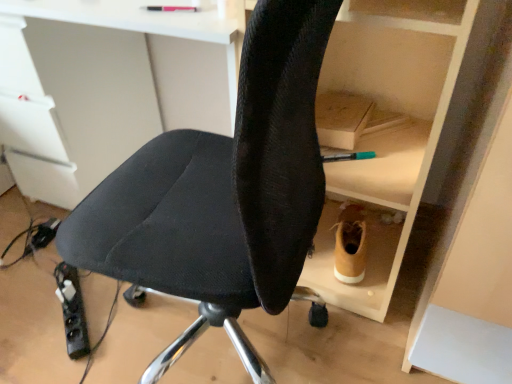
Locate an element on the screen. This screenshot has height=384, width=512. black fabric chair at center is located at coordinates (222, 192).

This screenshot has width=512, height=384. Describe the element at coordinates (350, 245) in the screenshot. I see `tan suede boot at lower right` at that location.

Find the location of a particular element. Image resolution: width=512 pixels, height=384 pixels. tan suede boot at lower right is located at coordinates (350, 245).

Find the location of a particular element. The height and width of the screenshot is (384, 512). black plastic power strip at lower left is located at coordinates (72, 310).

Is tan suede boot at lower right to the left or to the right of black plastic power strip at lower left in the image?

In the image, tan suede boot at lower right appears on the right side of black plastic power strip at lower left.

Who is shorter, tan suede boot at lower right or black plastic power strip at lower left?

Standing shorter between the two is black plastic power strip at lower left.

Can you tell me how much tan suede boot at lower right and black plastic power strip at lower left differ in facing direction?

They differ by 34.4 degrees in their facing directions.

Is black plastic power strip at lower left oriented away from black fabric chair at center?

black plastic power strip at lower left is not turned away from black fabric chair at center.

Looking at the image, does black plastic power strip at lower left seem bigger or smaller compared to black fabric chair at center?

Considering their sizes, black plastic power strip at lower left takes up less space than black fabric chair at center.

Is the surface of black plastic power strip at lower left in direct contact with black fabric chair at center?

No, black plastic power strip at lower left is not with black fabric chair at center.

Is point (82, 327) closer or farther from the camera than point (202, 158)?

Point (82, 327).

Which is more to the right, black plastic power strip at lower left or tan suede boot at lower right?

From the viewer's perspective, tan suede boot at lower right appears more on the right side.

In the scene shown: Is there a large distance between black plastic power strip at lower left and tan suede boot at lower right?

black plastic power strip at lower left is near tan suede boot at lower right, not far away.

From a real-world perspective, which is physically above, black plastic power strip at lower left or tan suede boot at lower right?

From a 3D spatial view, tan suede boot at lower right is above.

Is black plastic power strip at lower left thinner than tan suede boot at lower right?

In fact, black plastic power strip at lower left might be wider than tan suede boot at lower right.

Which of these two, tan suede boot at lower right or black fabric chair at center, is smaller?

With smaller size is tan suede boot at lower right.

Which of these two, tan suede boot at lower right or black fabric chair at center, is wider?

With larger width is black fabric chair at center.

From the image's perspective, relative to black fabric chair at center, is tan suede boot at lower right above or below?

From the image's perspective, tan suede boot at lower right appears below black fabric chair at center.

Is black fabric chair at center next to black plastic power strip at lower left and touching it?

No, black fabric chair at center is not touching black plastic power strip at lower left.

Does black fabric chair at center turn towards black plastic power strip at lower left?

Yes, black fabric chair at center is facing black plastic power strip at lower left.

In order to click on equipment below the black fabric chair at center (from the image's perspective) in this screenshot , I will do `click(72, 310)`.

Consider the image. Measure the distance between black fabric chair at center and black plastic power strip at lower left.

A distance of 63.90 centimeters exists between black fabric chair at center and black plastic power strip at lower left.

Which is more to the right, black fabric chair at center or tan suede boot at lower right?

tan suede boot at lower right is more to the right.

Would you consider black fabric chair at center to be distant from tan suede boot at lower right?

Actually, black fabric chair at center and tan suede boot at lower right are a little close together.

Is black fabric chair at center oriented towards tan suede boot at lower right?

No, black fabric chair at center is not facing towards tan suede boot at lower right.

Which object is more forward, black fabric chair at center or tan suede boot at lower right?

Positioned in front is black fabric chair at center.

You are a GUI agent. You are given a task and a screenshot of the screen. Output one action in this format:
    pyautogui.click(x=<x>, y=<y>)
    Task: Click on the equipment that is in front of the tan suede boot at lower right
    
    Given the screenshot: What is the action you would take?
    pyautogui.click(x=72, y=310)

Where is `chair on the right side of black plastic power strip at lower left`? Image resolution: width=512 pixels, height=384 pixels. chair on the right side of black plastic power strip at lower left is located at coordinates (222, 192).

From the image, which object appears to be nearer to tan suede boot at lower right, black fabric chair at center or black plastic power strip at lower left?

The object closer to tan suede boot at lower right is black fabric chair at center.

Which object lies nearer to the anchor point black fabric chair at center, tan suede boot at lower right or black plastic power strip at lower left?

tan suede boot at lower right.

In the scene shown: From the image, which object appears to be farther from tan suede boot at lower right, black plastic power strip at lower left or black fabric chair at center?

black plastic power strip at lower left is further to tan suede boot at lower right.

Which object lies nearer to the anchor point black plastic power strip at lower left, black fabric chair at center or tan suede boot at lower right?

black fabric chair at center is closer to black plastic power strip at lower left.

Estimate the real-world distances between objects in this image. Which object is further from black plastic power strip at lower left, tan suede boot at lower right or black fabric chair at center?

Among the two, tan suede boot at lower right is located further to black plastic power strip at lower left.

Which object lies further to the anchor point black fabric chair at center, black plastic power strip at lower left or tan suede boot at lower right?

The object further to black fabric chair at center is black plastic power strip at lower left.

Locate an element on the screen. This screenshot has width=512, height=384. equipment located between black fabric chair at center and tan suede boot at lower right in the depth direction is located at coordinates (72, 310).